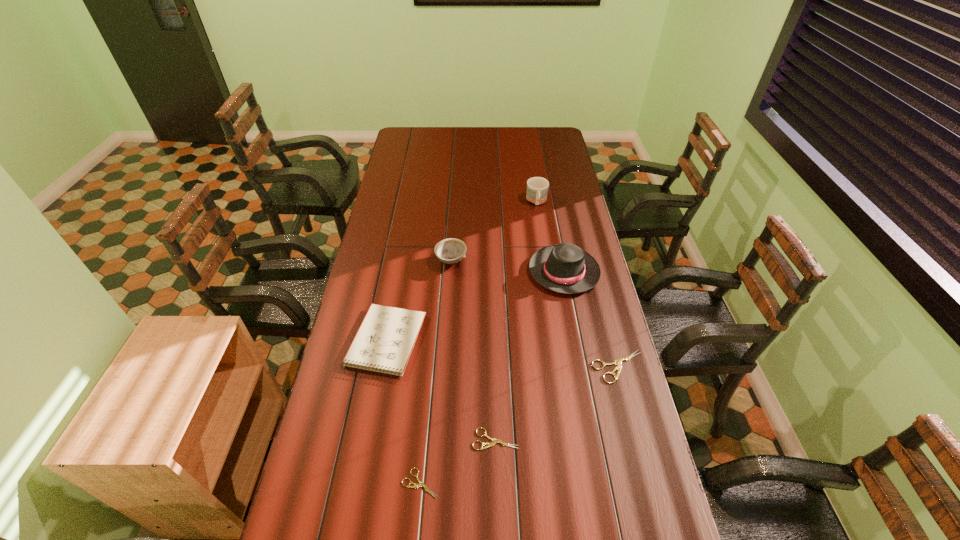
If equal spacing is desired by inserting an extra shears among them, please point out a free spot for this new shears. Please provide its 2D coordinates. Your answer should be formatted as a tuple, i.e. [(x, y)], where the tuple contains the x and y coordinates of a point satisfying the conditions above.

[(561, 401)]